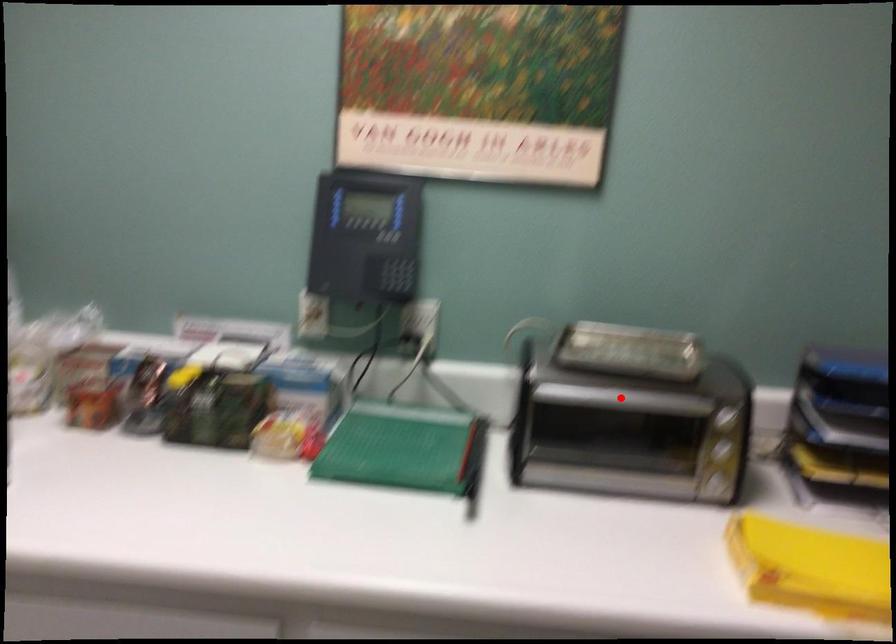
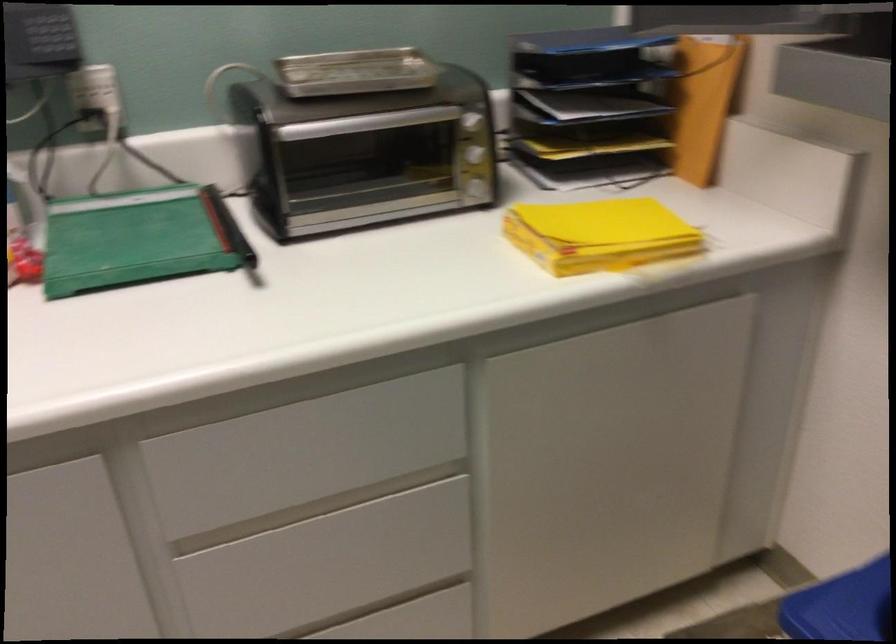
The point at the highlighted location is marked in the first image. Where is the corresponding point in the second image?

(366, 122)